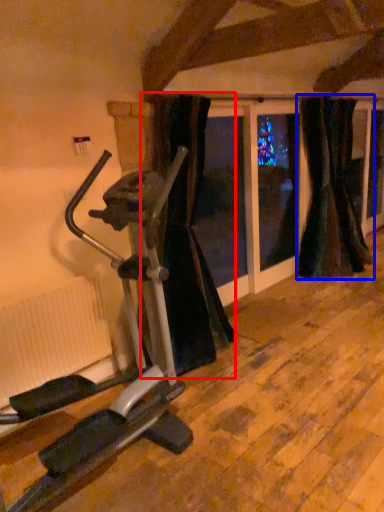
Question: Which object is further to the camera taking this photo, curtain (highlighted by a red box) or curtain (highlighted by a blue box)?

Choices:
 (A) curtain
 (B) curtain

Answer: (B)